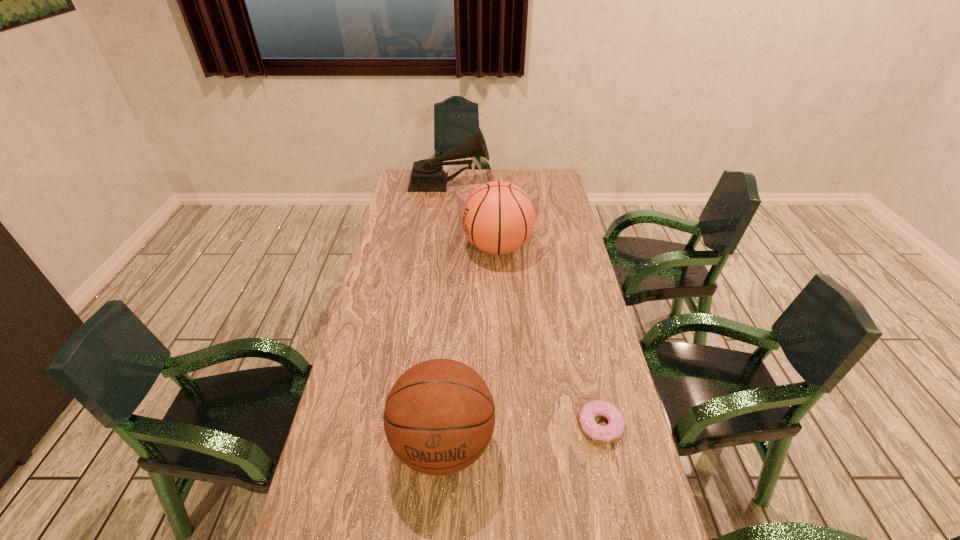
The height and width of the screenshot is (540, 960). I want to click on unoccupied area between the doughnut and the nearer basketball, so click(521, 434).

At what (x,y) coordinates should I click in order to perform the action: click on free space between the rightmost object and the farthest object. Please return your answer as a coordinate pair (x, y). The width and height of the screenshot is (960, 540). Looking at the image, I should click on (525, 305).

Locate an element on the screen. Image resolution: width=960 pixels, height=540 pixels. empty space that is in between the nearer basketball and the phonograph_record is located at coordinates (446, 314).

You are a GUI agent. You are given a task and a screenshot of the screen. Output one action in this format:
    pyautogui.click(x=<x>, y=<y>)
    Task: Click on the free space between the farthest object and the doughnut
    The image size is (960, 540).
    Given the screenshot: What is the action you would take?
    pyautogui.click(x=525, y=305)

Locate which object ranks in proximity to the phonograph_record. Please provide its 2D coordinates. Your answer should be formatted as a tuple, i.e. [(x, y)], where the tuple contains the x and y coordinates of a point satisfying the conditions above.

[(498, 217)]

Locate which object ranks second in proximity to the second farthest object. Please provide its 2D coordinates. Your answer should be formatted as a tuple, i.e. [(x, y)], where the tuple contains the x and y coordinates of a point satisfying the conditions above.

[(439, 416)]

Locate an element on the screen. This screenshot has width=960, height=540. vacant area that satisfies the following two spatial constraints: 1. on the back side of the shortest object; 2. on the surface of the farther basketball near the brand logo is located at coordinates (561, 247).

I want to click on free space that satisfies the following two spatial constraints: 1. on the surface of the farther basketball near the brand logo; 2. on the side with brand label of the nearer basketball, so click(x=507, y=444).

The height and width of the screenshot is (540, 960). Identify the location of vacant position in the image that satisfies the following two spatial constraints: 1. on the surface of the second farthest object near the brand logo; 2. on the side with brand label of the nearer basketball. (507, 444).

Image resolution: width=960 pixels, height=540 pixels. What are the coordinates of `free location that satisfies the following two spatial constraints: 1. on the surface of the farther basketball near the brand logo; 2. on the side with brand label of the nearer basketball` in the screenshot? It's located at pos(507,444).